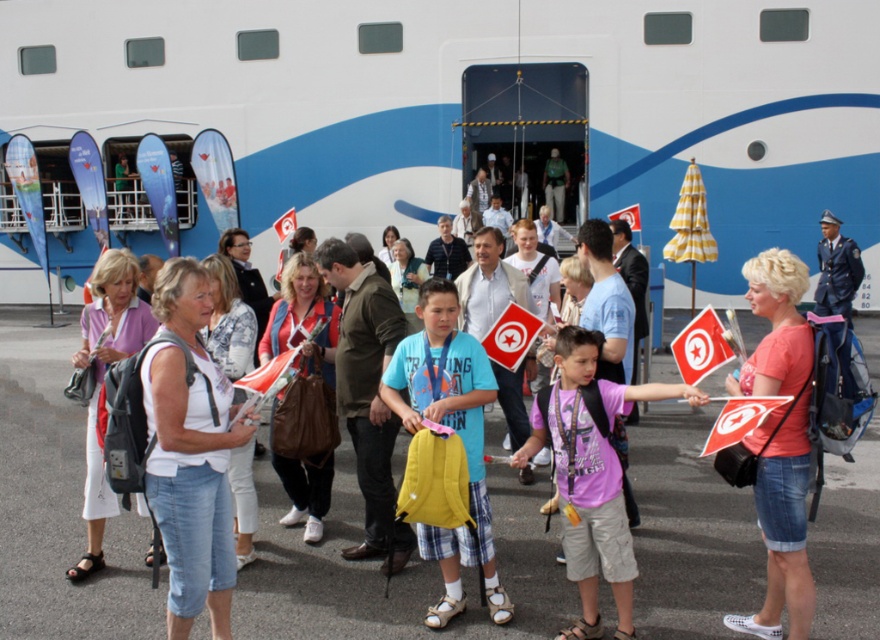
Question: Which point is farther to the camera?

Choices:
 (A) yellow fabric backpack at center
 (B) purple cotton shirt at center
 (C) pink cotton t-shirt at center

Answer: (A)

Question: Which point is closer to the camera taking this photo?

Choices:
 (A) (435, 317)
 (B) (539, 497)

Answer: (A)

Question: Can you confirm if yellow backpack at center is positioned below purple cotton shirt at center?

Choices:
 (A) no
 (B) yes

Answer: (B)

Question: Among these points, which one is farthest from the camera?

Choices:
 (A) (794, 580)
 (B) (431, 336)
 (C) (587, 545)
 (D) (356, 124)

Answer: (D)

Question: Does yellow backpack at center appear under yellow fabric backpack at center?

Choices:
 (A) no
 (B) yes

Answer: (B)

Question: Is yellow backpack at center below yellow fabric backpack at center?

Choices:
 (A) yes
 (B) no

Answer: (A)